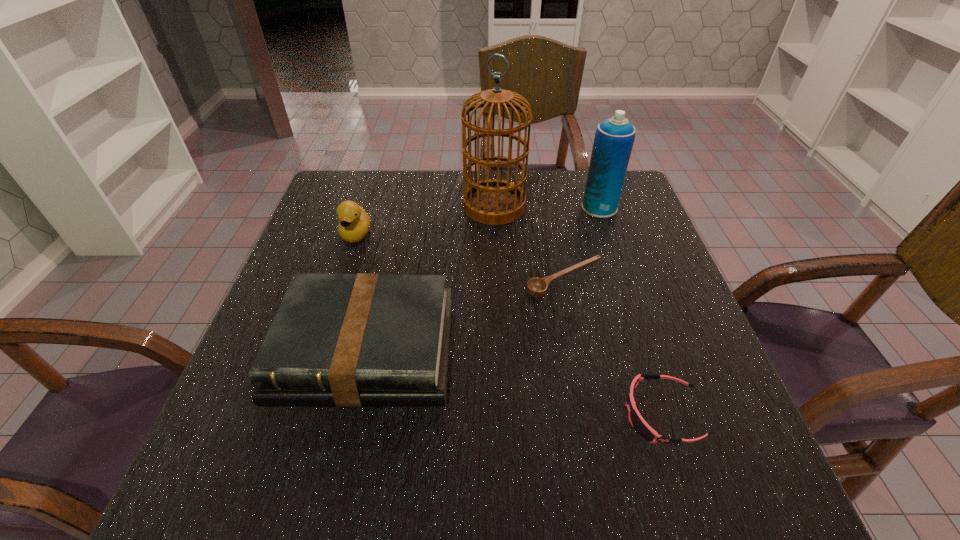
Locate an element on the screen. The width and height of the screenshot is (960, 540). free spot between the third shortest object and the aerosol can is located at coordinates (482, 279).

Locate an element on the screen. This screenshot has width=960, height=540. vacant area that lies between the birdcage and the goggles is located at coordinates (578, 310).

Where is `vacant space in between the duckling and the fifth tallest object`? The width and height of the screenshot is (960, 540). vacant space in between the duckling and the fifth tallest object is located at coordinates (509, 324).

The width and height of the screenshot is (960, 540). I want to click on free space between the fourth farthest object and the tallest object, so click(529, 243).

Identify which object is the second closest to the duckling. Please provide its 2D coordinates. Your answer should be formatted as a tuple, i.e. [(x, y)], where the tuple contains the x and y coordinates of a point satisfying the conditions above.

[(494, 202)]

Find the location of a particular element. the second closest object to the aerosol can is located at coordinates (537, 287).

The height and width of the screenshot is (540, 960). What are the coordinates of `free space that satisfies the following two spatial constraints: 1. on the front side of the wooden spoon; 2. on the left side of the birdcage` in the screenshot? It's located at (497, 280).

At what (x,y) coordinates should I click in order to perform the action: click on vacant area that satisfies the following two spatial constraints: 1. on the face of the wooden spoon; 2. on the right side of the duckling. Please return your answer as a coordinate pair (x, y). The height and width of the screenshot is (540, 960). Looking at the image, I should click on (342, 280).

Where is `free space that satisfies the following two spatial constraints: 1. on the face of the third nearest object; 2. on the left side of the duckling`? The image size is (960, 540). free space that satisfies the following two spatial constraints: 1. on the face of the third nearest object; 2. on the left side of the duckling is located at coordinates (342, 280).